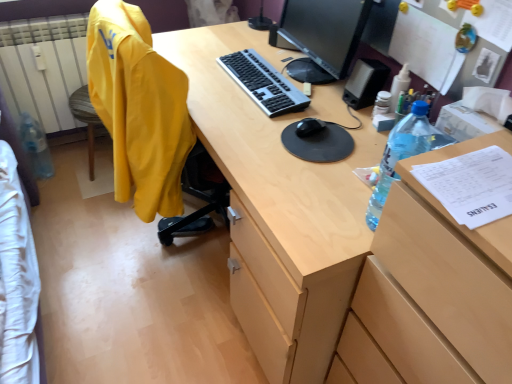
Where is `vacant area that lies between black matte mouse at center and black plastic speaker at upper right`? vacant area that lies between black matte mouse at center and black plastic speaker at upper right is located at coordinates (334, 109).